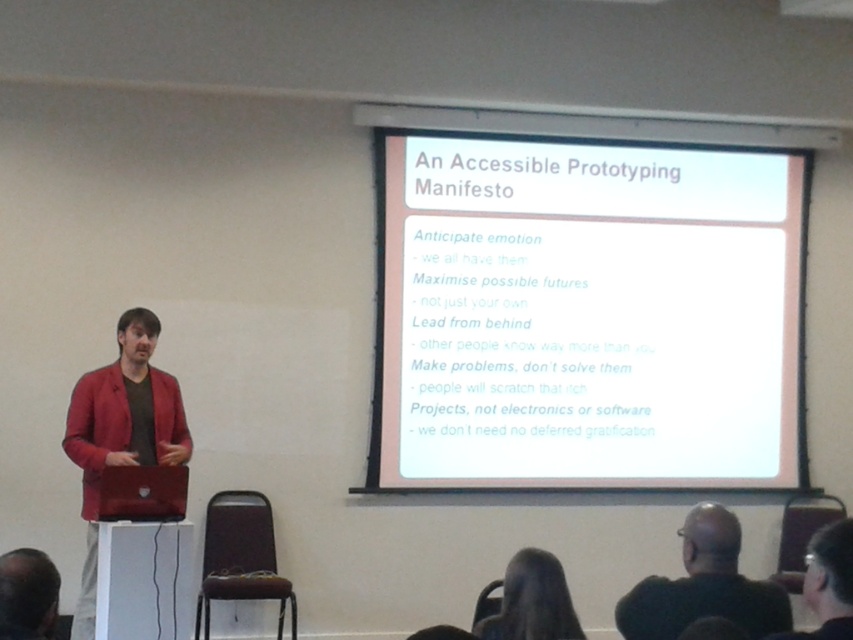
You are an attendee at the presentation and want to take a photo of the presenter. You notice the dark green sweater at lower right and the dark brown hair at lower left. Which object should you focus on first to ensure both are in focus?

You should focus on the dark green sweater at lower right first because it is closer to you than the dark brown hair at lower left, so focusing on the closer object will help both be in focus.

You are an event organizer who needs to ensure that all attendees can see the presenter clearly. Considering the dark green sweater at lower right and the dark brown hair at lower left, which object is more likely to block the presenter from the audience? Please explain your reasoning.

The dark green sweater at lower right is larger in size than the dark brown hair at lower left. Since the sweater is larger, it is more likely to block the presenter from the audience if positioned between them and the podium.

You are an attendee at the presentation and want to take a photo of the presenter. You notice the dark green sweater at lower right and the dark hair at lower center. Which object should you focus on to capture the presenter clearly?

The dark green sweater at lower right is located above dark hair at lower center, so focusing on the dark green sweater at lower right will ensure the presenter is captured clearly as it is positioned higher up.